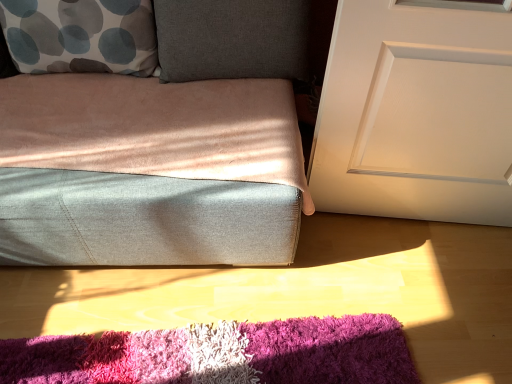
Describe the element at coordinates (220, 354) in the screenshot. I see `shaggy multicolor rug at lower center` at that location.

The width and height of the screenshot is (512, 384). Describe the element at coordinates (232, 39) in the screenshot. I see `dark gray fabric pillow at upper center` at that location.

I want to click on white matte door at right, so click(x=416, y=112).

Describe the element at coordinates (80, 35) in the screenshot. This screenshot has height=384, width=512. I see `white with gray and blue circles pillow at upper left` at that location.

Where is `shaggy multicolor rug at lower center`? Image resolution: width=512 pixels, height=384 pixels. shaggy multicolor rug at lower center is located at coordinates (220, 354).

Who is shorter, white matte door at right or white with gray and blue circles pillow at upper left?

white with gray and blue circles pillow at upper left is shorter.

Is white matte door at right located outside white with gray and blue circles pillow at upper left?

white matte door at right is positioned outside white with gray and blue circles pillow at upper left.

Does white matte door at right have a greater width compared to white with gray and blue circles pillow at upper left?

No, white matte door at right is not wider than white with gray and blue circles pillow at upper left.

From the image's perspective, is shaggy multicolor rug at lower center positioned above or below white with gray and blue circles pillow at upper left?

Based on their image positions, shaggy multicolor rug at lower center is located beneath white with gray and blue circles pillow at upper left.

Is point (305, 354) in front of point (73, 43)?

Yes, it is.

Can you see shaggy multicolor rug at lower center touching white with gray and blue circles pillow at upper left?

No.

Would you say shaggy multicolor rug at lower center is inside or outside white with gray and blue circles pillow at upper left?

shaggy multicolor rug at lower center is spatially situated outside white with gray and blue circles pillow at upper left.

From the image's perspective, does white with gray and blue circles pillow at upper left appear lower than shaggy multicolor rug at lower center?

No, from the image's perspective, white with gray and blue circles pillow at upper left is not beneath shaggy multicolor rug at lower center.

Is white with gray and blue circles pillow at upper left wider or thinner than shaggy multicolor rug at lower center?

Clearly, white with gray and blue circles pillow at upper left has less width compared to shaggy multicolor rug at lower center.

Considering the sizes of objects white with gray and blue circles pillow at upper left and shaggy multicolor rug at lower center in the image provided, who is shorter, white with gray and blue circles pillow at upper left or shaggy multicolor rug at lower center?

shaggy multicolor rug at lower center.

Is shaggy multicolor rug at lower center located within white with gray and blue circles pillow at upper left?

No, shaggy multicolor rug at lower center is not a part of white with gray and blue circles pillow at upper left.

Considering their positions, is white with gray and blue circles pillow at upper left located in front of or behind white matte door at right?

Clearly, white with gray and blue circles pillow at upper left is behind white matte door at right.

Which is behind, point (32, 48) or point (343, 65)?

Point (32, 48)

Are white with gray and blue circles pillow at upper left and white matte door at right far apart?

No, white with gray and blue circles pillow at upper left is not far from white matte door at right.

Is white with gray and blue circles pillow at upper left oriented towards white matte door at right?

No, white with gray and blue circles pillow at upper left does not turn towards white matte door at right.

Consider the image. Is white matte door at right outside of shaggy multicolor rug at lower center?

white matte door at right is positioned outside shaggy multicolor rug at lower center.

Considering the sizes of white matte door at right and shaggy multicolor rug at lower center in the image, is white matte door at right wider or thinner than shaggy multicolor rug at lower center?

Clearly, white matte door at right has less width compared to shaggy multicolor rug at lower center.

From a real-world perspective, which is physically below, white matte door at right or shaggy multicolor rug at lower center?

shaggy multicolor rug at lower center, from a real-world perspective.

Considering the positions of point (466, 85) and point (245, 332), is point (466, 85) closer or farther from the camera than point (245, 332)?

Point (466, 85) is positioned closer to the camera compared to point (245, 332).

Is white matte door at right to the left of dark gray fabric pillow at upper center from the viewer's perspective?

No.

In the scene shown: Is white matte door at right aimed at dark gray fabric pillow at upper center?

No.

Identify the location of pillow to the left of white matte door at right. (232, 39).

Does point (459, 193) come in front of point (156, 23)?

No.

Is white with gray and blue circles pillow at upper left at the back of dark gray fabric pillow at upper center?

No, dark gray fabric pillow at upper center is not facing away from white with gray and blue circles pillow at upper left.

Is dark gray fabric pillow at upper center taller than white with gray and blue circles pillow at upper left?

Yes, dark gray fabric pillow at upper center is taller than white with gray and blue circles pillow at upper left.

Which is closer to the camera, (239,51) or (95,0)?

The point (95,0) is closer to the camera.

At what (x,y) coordinates should I click in order to perform the action: click on door in front of the white with gray and blue circles pillow at upper left. Please return your answer as a coordinate pair (x, y). Looking at the image, I should click on (416, 112).

Find the location of a particular element. This screenshot has height=384, width=512. mat below the white with gray and blue circles pillow at upper left (from a real-world perspective) is located at coordinates (220, 354).

When comparing their distances from shaggy multicolor rug at lower center, does white with gray and blue circles pillow at upper left or white matte door at right seem closer?

white matte door at right lies closer to shaggy multicolor rug at lower center than the other object.

When comparing their distances from dark gray fabric pillow at upper center, does shaggy multicolor rug at lower center or white matte door at right seem closer?

Based on the image, white matte door at right appears to be nearer to dark gray fabric pillow at upper center.

Which object lies further to the anchor point white with gray and blue circles pillow at upper left, dark gray fabric pillow at upper center or shaggy multicolor rug at lower center?

shaggy multicolor rug at lower center is further to white with gray and blue circles pillow at upper left.

Which object lies nearer to the anchor point dark gray fabric pillow at upper center, white with gray and blue circles pillow at upper left or shaggy multicolor rug at lower center?

Based on the image, white with gray and blue circles pillow at upper left appears to be nearer to dark gray fabric pillow at upper center.

Which object lies further to the anchor point white matte door at right, white with gray and blue circles pillow at upper left or dark gray fabric pillow at upper center?

Based on the image, white with gray and blue circles pillow at upper left appears to be further to white matte door at right.

From the image, which object appears to be farther from dark gray fabric pillow at upper center, white with gray and blue circles pillow at upper left or white matte door at right?

white matte door at right lies further to dark gray fabric pillow at upper center than the other object.

Which object lies nearer to the anchor point shaggy multicolor rug at lower center, white matte door at right or white with gray and blue circles pillow at upper left?

white matte door at right is positioned closer to the anchor shaggy multicolor rug at lower center.

Considering their positions, is white matte door at right positioned further to white with gray and blue circles pillow at upper left than dark gray fabric pillow at upper center?

The object further to white with gray and blue circles pillow at upper left is white matte door at right.

Locate an element on the screen. door between dark gray fabric pillow at upper center and shaggy multicolor rug at lower center in the up-down direction is located at coordinates coord(416,112).

Locate an element on the screen. The width and height of the screenshot is (512, 384). mat situated between white with gray and blue circles pillow at upper left and white matte door at right from left to right is located at coordinates (220, 354).

You are a GUI agent. You are given a task and a screenshot of the screen. Output one action in this format:
    pyautogui.click(x=<x>, y=<y>)
    Task: Click on the throw pillow that lies between dark gray fabric pillow at upper center and shaggy multicolor rug at lower center from top to bottom
    
    Given the screenshot: What is the action you would take?
    pyautogui.click(x=80, y=35)

Identify the location of pillow located between white with gray and blue circles pillow at upper left and white matte door at right in the left-right direction. (232, 39).